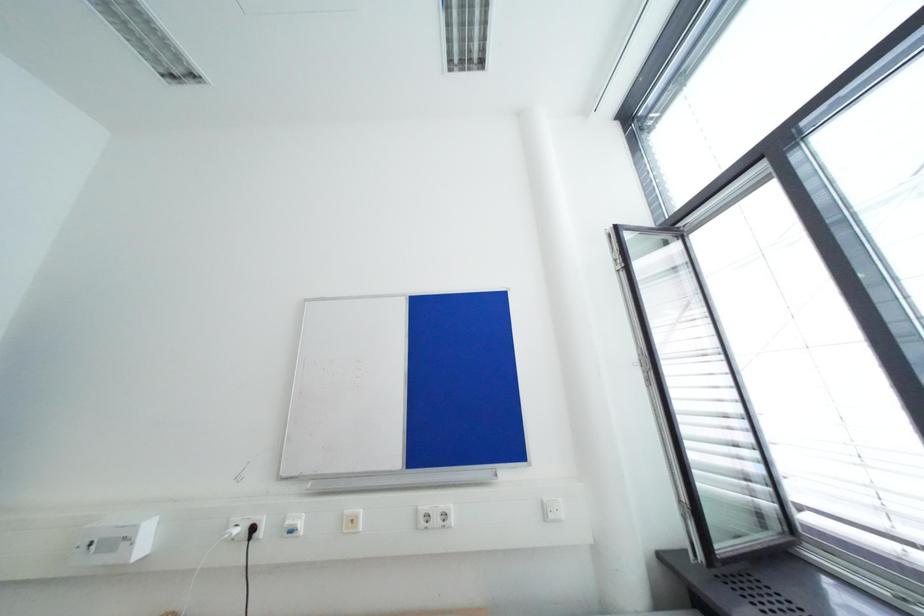
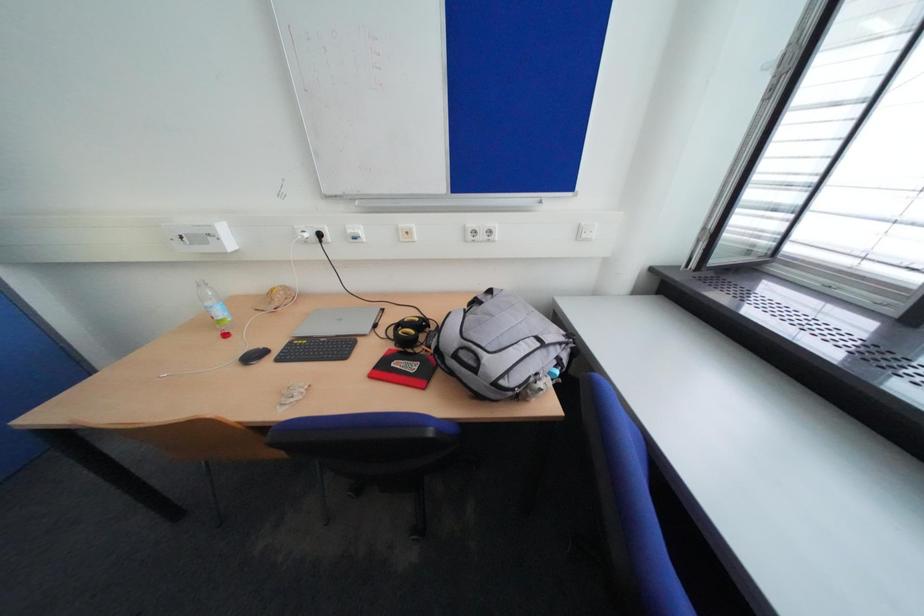
Question: Based on the continuous images, in which direction is the camera rotating? Reply with the corresponding letter.

Choices:
 (A) Left
 (B) Right
 (C) Up
 (D) Down

Answer: (D)